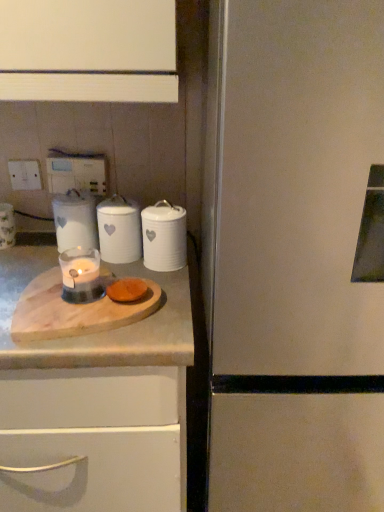
Question: Could white ceramic candle at center, the third kitchen appliance when ordered from right to left, be considered to be inside white plastic electric outlet at upper left, placed as the 1th electric outlet when sorted from right to left?

Choices:
 (A) yes
 (B) no

Answer: (B)

Question: From the image's perspective, would you say white plastic electric outlet at upper left, which appears as the second electric outlet when viewed from the left, is positioned over white ceramic candle at center, which is the 1th kitchen appliance from left to right?

Choices:
 (A) yes
 (B) no

Answer: (A)

Question: Is the position of white plastic electric outlet at upper left, placed as the 1th electric outlet when sorted from right to left, more distant than that of white ceramic candle at center, which is the 1th kitchen appliance from left to right?

Choices:
 (A) yes
 (B) no

Answer: (A)

Question: From a real-world perspective, does white plastic electric outlet at upper left, which appears as the second electric outlet when viewed from the left, stand above white ceramic candle at center, the third kitchen appliance when ordered from right to left?

Choices:
 (A) yes
 (B) no

Answer: (A)

Question: Is white plastic electric outlet at upper left, which appears as the second electric outlet when viewed from the left, not inside white ceramic candle at center, the third kitchen appliance when ordered from right to left?

Choices:
 (A) yes
 (B) no

Answer: (A)

Question: Can you confirm if white plastic electric outlet at upper left, which appears as the second electric outlet when viewed from the left, is thinner than white ceramic candle at center, which is the 1th kitchen appliance from left to right?

Choices:
 (A) yes
 (B) no

Answer: (A)

Question: Is white plastic electric outlet at upper left, which is the 2th electric outlet from right to left, thinner than translucent glass candle at center?

Choices:
 (A) no
 (B) yes

Answer: (B)

Question: Is translucent glass candle at center at the back of white plastic electric outlet at upper left, the first electric outlet from the left?

Choices:
 (A) yes
 (B) no

Answer: (B)

Question: Is white plastic electric outlet at upper left, which is the 2th electric outlet from right to left, next to translucent glass candle at center and touching it?

Choices:
 (A) no
 (B) yes

Answer: (A)

Question: Is white plastic electric outlet at upper left, the first electric outlet from the left, to the right of translucent glass candle at center from the viewer's perspective?

Choices:
 (A) yes
 (B) no

Answer: (B)

Question: From the image's perspective, is white plastic electric outlet at upper left, the first electric outlet from the left, under translucent glass candle at center?

Choices:
 (A) no
 (B) yes

Answer: (A)

Question: Is there a large distance between white plastic electric outlet at upper left, which is the 2th electric outlet from right to left, and translucent glass candle at center?

Choices:
 (A) no
 (B) yes

Answer: (A)

Question: Would you say satin white refrigerator at right is a long distance from white ceramic canister at center, the first kitchen appliance when ordered from right to left?

Choices:
 (A) yes
 (B) no

Answer: (B)